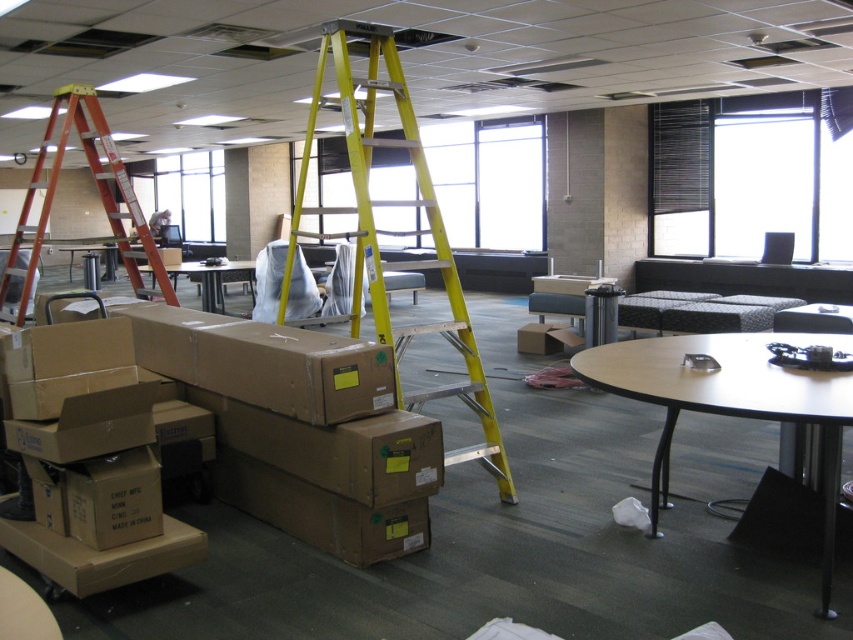
You are an office worker who needs to reach a high shelf to retrieve a file. You see the yellow metallic ladder at center and the black plastic table at lower right. Which object should you use to reach the high shelf?

You should use the yellow metallic ladder at center to reach the high shelf because it is designed for climbing and accessing higher areas, while the black plastic table at lower right is positioned below the ladder and likely not tall enough.

You are standing at the entrance of the office and want to place a new desk. The office has a black plastic table at lower right. Where exactly should you place the new desk to avoid blocking the entrance?

The black plastic table at lower right is located at point (730,401), so you should place the new desk away from that coordinate to avoid blocking the entrance.

You are standing in the office and need to reach a tool placed on a high shelf. The yellow metallic ladder at center is available. Can you safely use it to reach the shelf if you are 1.7 meters away from the ladder?

The yellow metallic ladder at center is 3.29 meters away from camera. Since you are 1.7 meters away from the ladder, the total distance between you and the shelf would depend on the shelf location. However, the ladder itself is positioned 3.29 meters from your current position, so you can move towards it and safely use it to reach the shelf as long as the shelf is within the ladder height range.